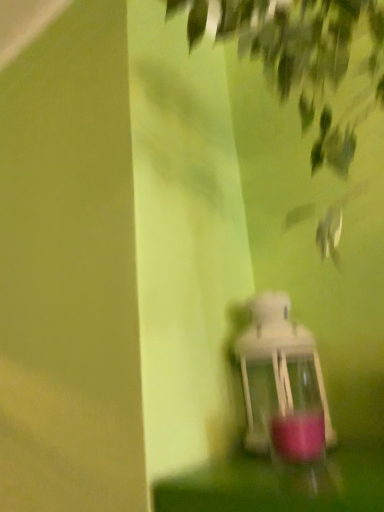
The image size is (384, 512). What do you see at coordinates (278, 369) in the screenshot?
I see `white glass lantern at center` at bounding box center [278, 369].

Locate an element on the screen. Image resolution: width=384 pixels, height=512 pixels. white glass lantern at center is located at coordinates (278, 369).

In order to click on white glass lantern at center in this screenshot , I will do `click(278, 369)`.